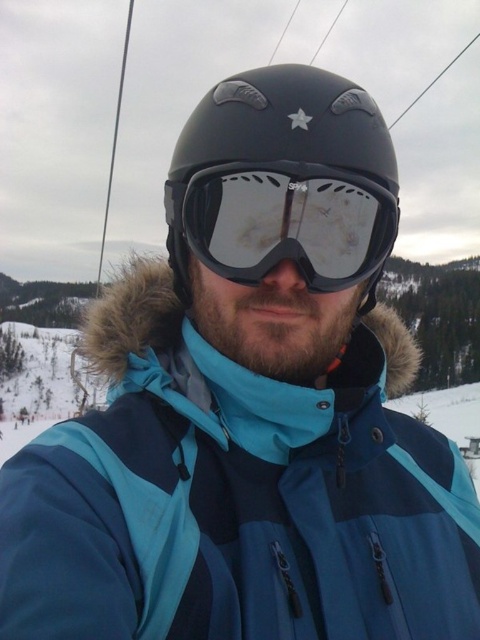
Where is `blue synthetic jacket at center`? Image resolution: width=480 pixels, height=640 pixels. blue synthetic jacket at center is located at coordinates (236, 497).

Locate an element on the screen. This screenshot has width=480, height=640. blue synthetic jacket at center is located at coordinates (236, 497).

Can you confirm if matte black helmet at center is positioned to the right of matte black goggles at center?

In fact, matte black helmet at center is to the left of matte black goggles at center.

Who is higher up, matte black helmet at center or matte black goggles at center?

matte black helmet at center is higher up.

Who is more forward, (295, 168) or (376, 214)?

Positioned in front is point (295, 168).

Locate an element on the screen. matte black helmet at center is located at coordinates (284, 182).

Is point (24, 515) behind point (304, 264)?

That is False.

Identify the location of blue synthetic jacket at center. (236, 497).

Where is `blue synthetic jacket at center`? The height and width of the screenshot is (640, 480). blue synthetic jacket at center is located at coordinates (236, 497).